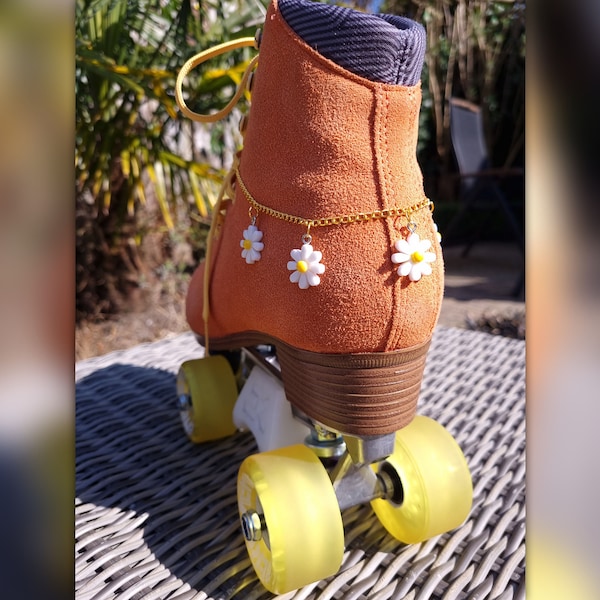
Locate an element on the screen. This screenshot has width=600, height=600. table/bench is located at coordinates (88, 483).